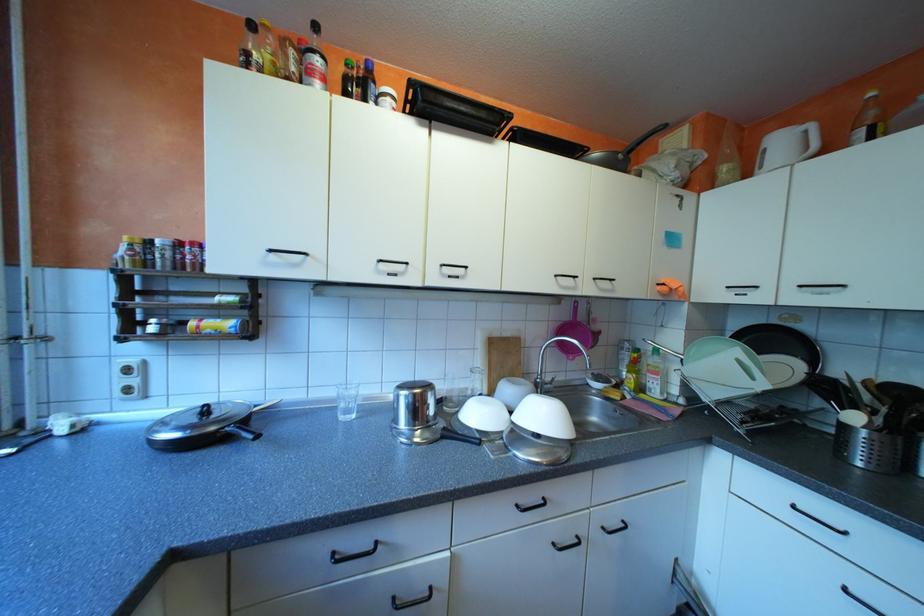
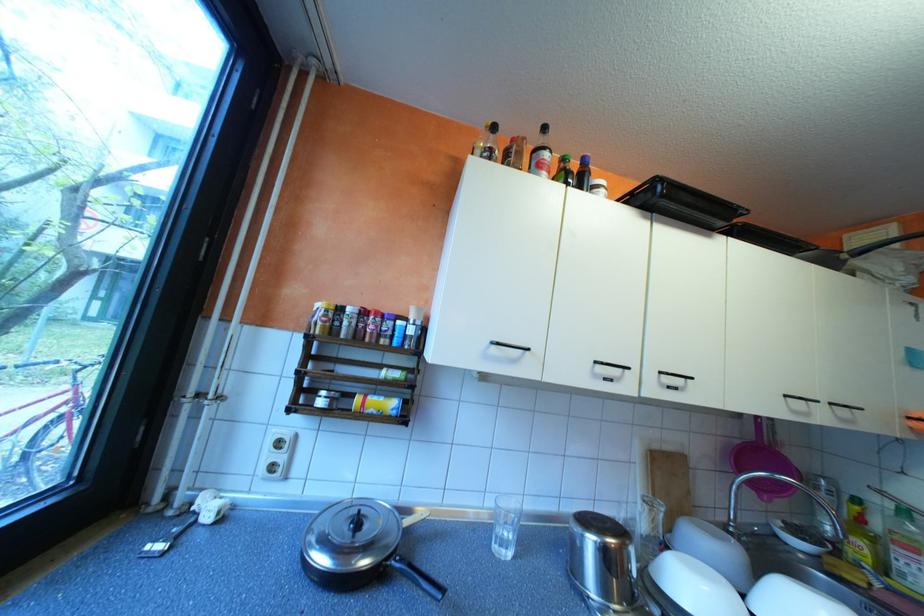
Question: Which direction would the cameraman need to move to produce the second image? Reply with the corresponding letter.

Choices:
 (A) Left
 (B) Right
 (C) Forward
 (D) Backward

Answer: (A)